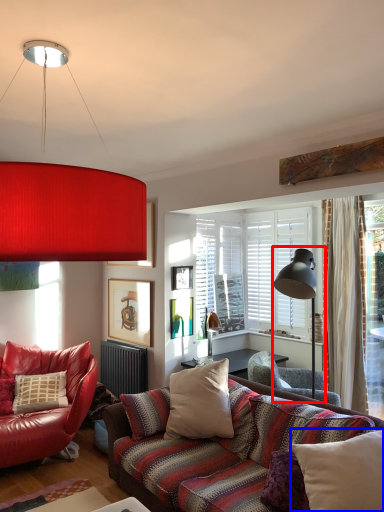
Question: Which of the following is the closest to the observer, table lamp (highlighted by a red box) or pillow (highlighted by a blue box)?

Choices:
 (A) table lamp
 (B) pillow

Answer: (B)